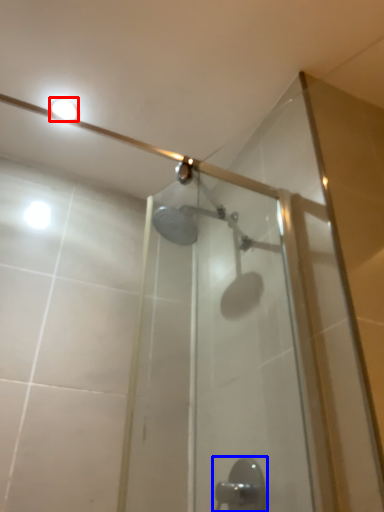
Question: Which point is further to the camera, light fixture (highlighted by a red box) or door handle (highlighted by a blue box)?

Choices:
 (A) light fixture
 (B) door handle

Answer: (A)